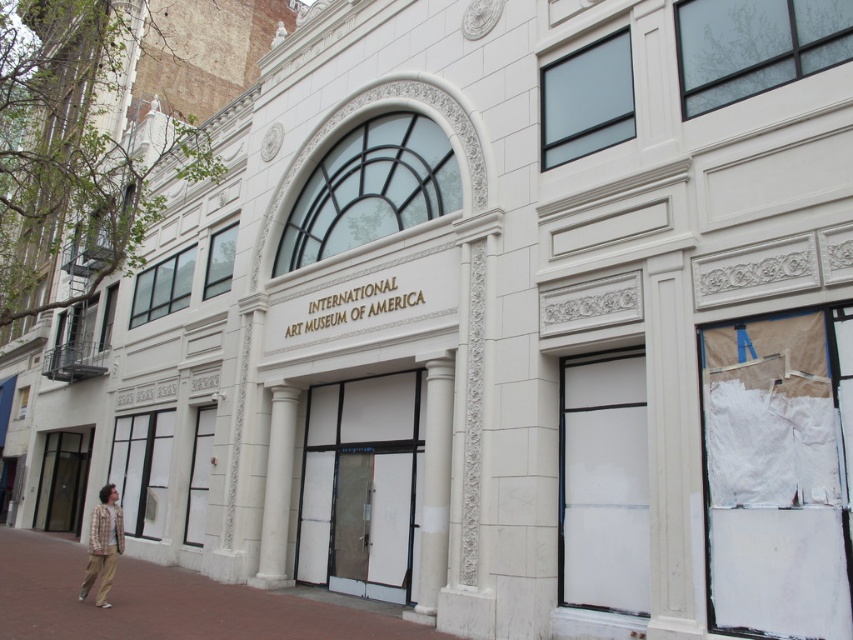
Question: Does white marble pillar at center appear on the left side of white marble column at center?

Choices:
 (A) no
 (B) yes

Answer: (A)

Question: Estimate the real-world distances between objects in this image. Which object is farther from the plaid shirt at lower left?

Choices:
 (A) brown brick pavement at lower left
 (B) white marble column at center
 (C) white marble pillar at center

Answer: (C)

Question: Is white marble column at center behind plaid shirt at lower left?

Choices:
 (A) yes
 (B) no

Answer: (A)

Question: Which point is farther to the camera?

Choices:
 (A) white marble pillar at center
 (B) white marble column at center

Answer: (B)

Question: Which object is the farthest from the white marble column at center?

Choices:
 (A) plaid shirt at lower left
 (B) brown brick pavement at lower left

Answer: (A)

Question: Is brown brick pavement at lower left to the right of plaid shirt at lower left from the viewer's perspective?

Choices:
 (A) yes
 (B) no

Answer: (B)